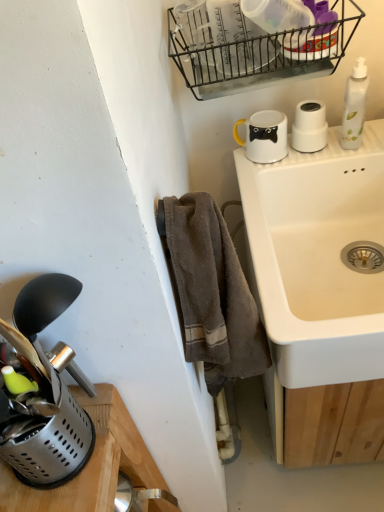
Question: From a real-world perspective, relative to white glossy mug at upper center, the second appliance from the right, is black wire basket at upper center vertically above or below?

Choices:
 (A) below
 (B) above

Answer: (B)

Question: Considering the positions of point (271, 71) and point (233, 128), is point (271, 71) closer or farther from the camera than point (233, 128)?

Choices:
 (A) closer
 (B) farther

Answer: (A)

Question: Which object is positioned farthest from the black wire basket at upper center?

Choices:
 (A) white matte cup at upper right, which ranks as the first appliance in right-to-left order
 (B) white glossy mug at upper center, which appears as the 2th appliance when viewed from the front
 (C) white ceramic sink at upper right
 (D) metallic silver utensil holder at lower left, the first appliance ordered from the bottom
 (E) brown cotton towel at lower center

Answer: (D)

Question: Considering the real-world distances, which object is closest to the brown cotton towel at lower center?

Choices:
 (A) white translucent bottle at upper right
 (B) metallic silver utensil holder at lower left, which is counted as the third appliance, starting from the back
 (C) white matte cup at upper right, the 3th appliance when ordered from front to back
 (D) white ceramic sink at upper right
 (E) white glossy mug at upper center, the second appliance from the right

Answer: (B)